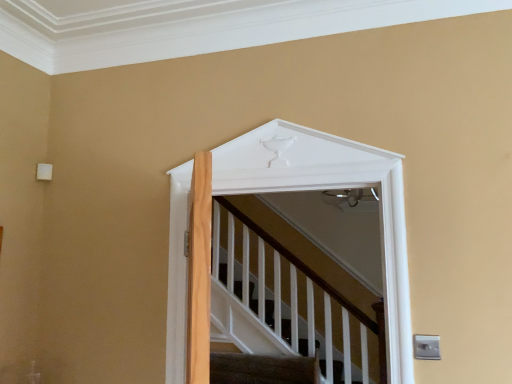
Identify the location of empty space that is ontop of white matte door at upper center. (278, 110).